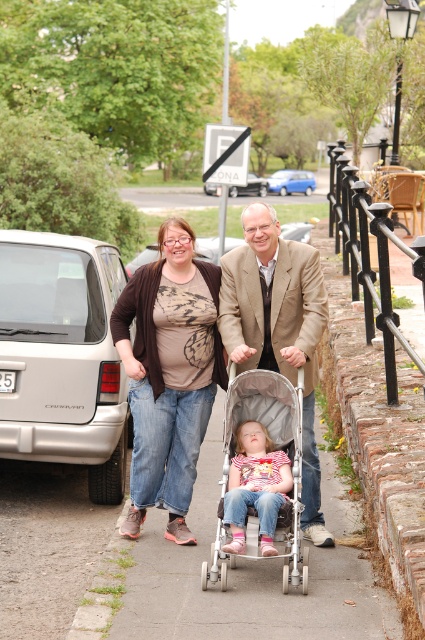
Question: Among these objects, which one is farthest from the camera?

Choices:
 (A) silver metallic van at left
 (B) silver metallic sedan at center
 (C) brown cardigan at center
 (D) tan woolen suit at center

Answer: (B)

Question: Is tan woolen suit at center above blue metallic car at center?

Choices:
 (A) no
 (B) yes

Answer: (A)

Question: Is tan woolen suit at center positioned behind matte pink shirt at center?

Choices:
 (A) yes
 (B) no

Answer: (A)

Question: Is silver metallic stroller at center thinner than matte pink shirt at center?

Choices:
 (A) yes
 (B) no

Answer: (B)

Question: Which point appears closest to the camera in this image?

Choices:
 (A) (275, 451)
 (B) (8, 260)
 (C) (248, 180)

Answer: (A)

Question: Which of the following is the closest to the observer?

Choices:
 (A) silver metallic stroller at center
 (B) matte pink shirt at center
 (C) silver metallic sedan at center
 (D) blue metallic car at center

Answer: (A)